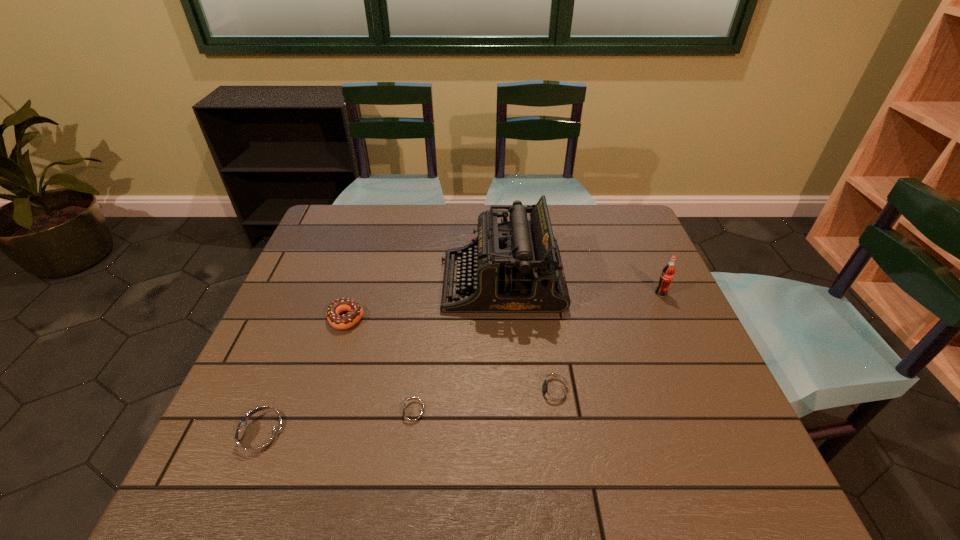
Identify which object is the nearest to the leftmost watch. Please provide its 2D coordinates. Your answer should be formatted as a tuple, i.e. [(x, y)], where the tuple contains the x and y coordinates of a point satisfying the conditions above.

[(412, 414)]

Identify which object is the fifth closest to the doughnut. Please provide its 2D coordinates. Your answer should be formatted as a tuple, i.e. [(x, y)], where the tuple contains the x and y coordinates of a point satisfying the conditions above.

[(668, 272)]

Where is `watch that is the closest to the leftmost watch`? The image size is (960, 540). watch that is the closest to the leftmost watch is located at coordinates (412, 414).

Point out which watch is positioned as the nearest to the typewriter. Please provide its 2D coordinates. Your answer should be formatted as a tuple, i.e. [(x, y)], where the tuple contains the x and y coordinates of a point satisfying the conditions above.

[(553, 393)]

Identify the location of free space that satisfies the following two spatial constraints: 1. on the keyboard of the tallest object; 2. on the front side of the doughnut. (503, 319).